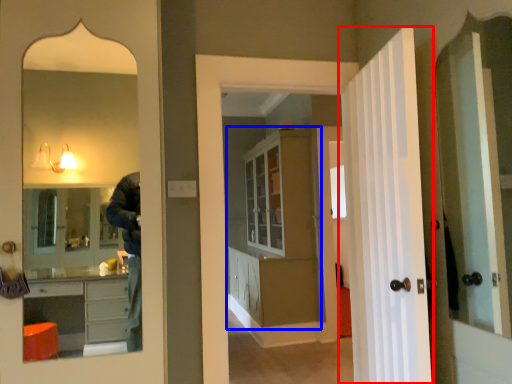
Question: Which of the following is the farthest to the observer, door (highlighted by a red box) or dresser (highlighted by a blue box)?

Choices:
 (A) door
 (B) dresser

Answer: (B)